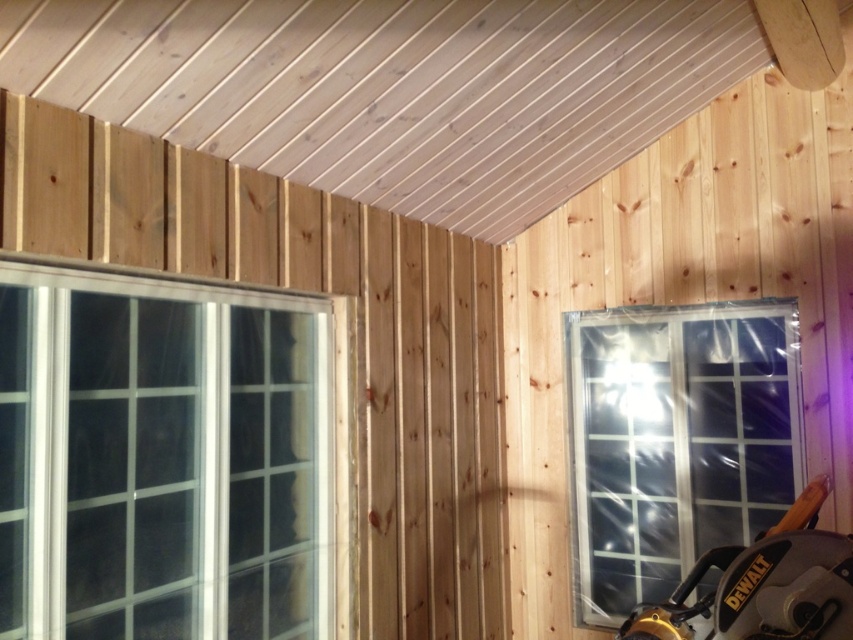
Is clear plastic window at center right positioned at the back of black plastic saw at lower right?

Yes, it is behind black plastic saw at lower right.

Who is more forward, (631, 426) or (849, 552)?

Point (849, 552)

In order to click on clear plastic window at center right in this screenshot , I will do `click(675, 442)`.

Between clear glass window at left and black plastic saw at lower right, which one is positioned higher?

clear glass window at left is above.

Is clear glass window at left positioned behind black plastic saw at lower right?

No, clear glass window at left is closer to the viewer.

Does point (277, 632) lie in front of point (811, 577)?

No.

Locate an element on the screen. This screenshot has width=853, height=640. clear glass window at left is located at coordinates (163, 458).

Who is shorter, clear glass window at left or clear plastic window at center right?

A: clear glass window at left

Which of these two, clear glass window at left or clear plastic window at center right, stands taller?

With more height is clear plastic window at center right.

You are a GUI agent. You are given a task and a screenshot of the screen. Output one action in this format:
    pyautogui.click(x=<x>, y=<y>)
    Task: Click on the clear glass window at left
    The height and width of the screenshot is (640, 853).
    Given the screenshot: What is the action you would take?
    pyautogui.click(x=163, y=458)